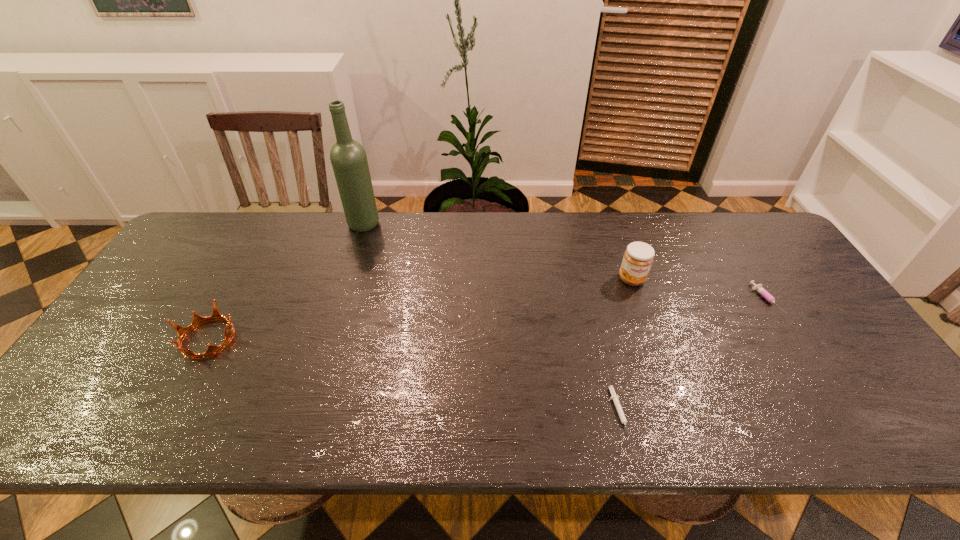
Locate an element on the screen. Image resolution: width=960 pixels, height=540 pixels. vacant position at the right edge of the desktop is located at coordinates (866, 383).

In order to click on free spot between the tallest object and the nearest object in this screenshot , I will do `click(491, 319)`.

The width and height of the screenshot is (960, 540). In order to click on free space that is in between the jam and the third tallest object in this screenshot , I will do `click(420, 309)`.

Image resolution: width=960 pixels, height=540 pixels. In order to click on vacant space that is in between the nearest object and the fourth shortest object in this screenshot , I will do click(625, 346).

Locate an element on the screen. free spot between the leftmost object and the nearest object is located at coordinates (413, 375).

Where is `vacant space in between the crown and the tallest object`? Image resolution: width=960 pixels, height=540 pixels. vacant space in between the crown and the tallest object is located at coordinates coord(286,281).

Find the location of a particular element. Image resolution: width=960 pixels, height=540 pixels. unoccupied area between the tallest object and the farther syringe is located at coordinates (564, 262).

Identify the location of unoccupied position between the farthest object and the jam. (497, 252).

Find the location of a particular element. Image resolution: width=960 pixels, height=540 pixels. unoccupied position between the second object from right to left and the farther syringe is located at coordinates (699, 289).

Image resolution: width=960 pixels, height=540 pixels. Identify the location of free space between the farthest object and the nearer syringe. (491, 319).